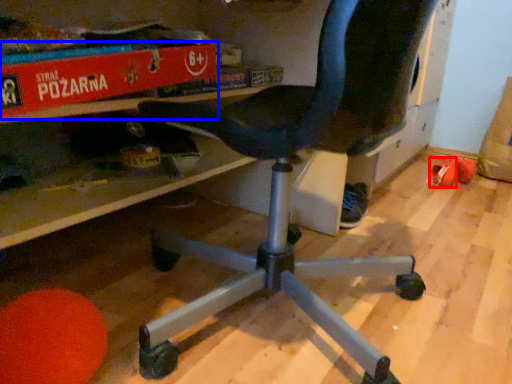
Question: Which point is closer to the camera, footwear (highlighted by a red box) or paperback book (highlighted by a blue box)?

Choices:
 (A) footwear
 (B) paperback book

Answer: (B)